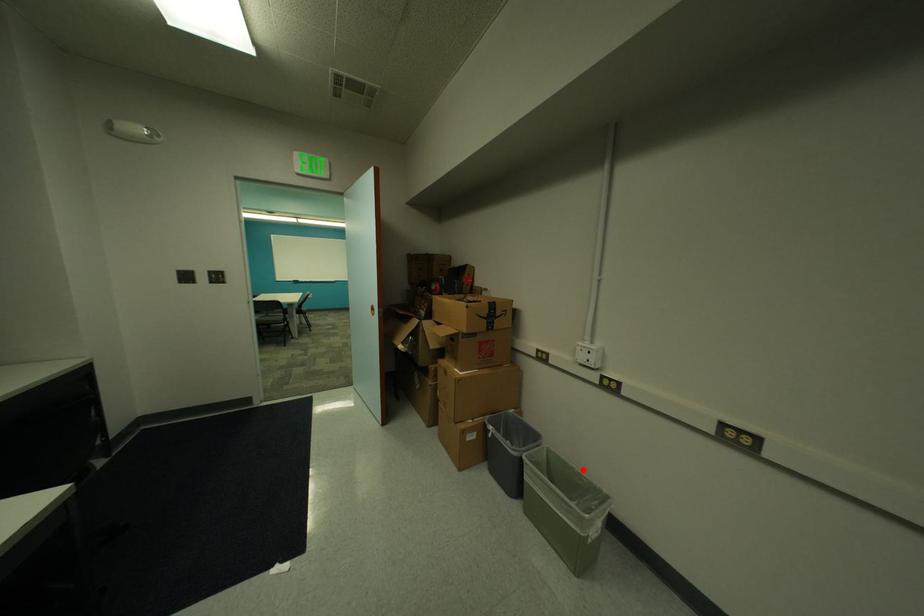
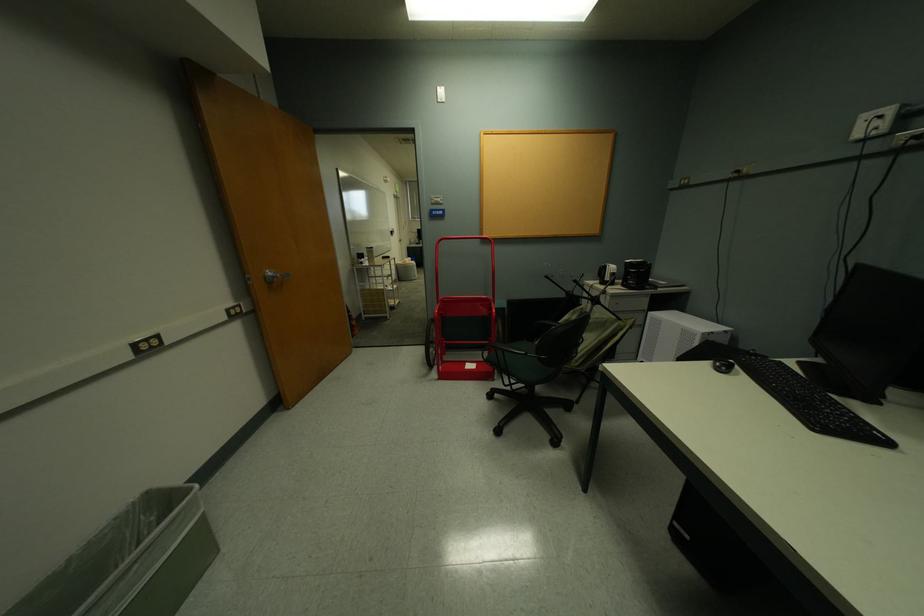
The point at the highlighted location is marked in the first image. Where is the corresponding point in the second image?

(79, 560)